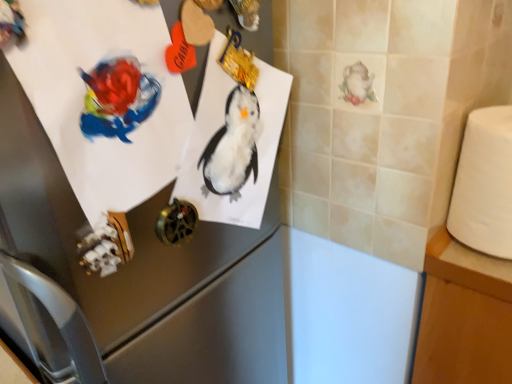
Question: Could white matte toilet paper at right be considered to be inside white wood table at right?

Choices:
 (A) yes
 (B) no

Answer: (B)

Question: Is white wood table at right positioned with its back to white matte toilet paper at right?

Choices:
 (A) yes
 (B) no

Answer: (B)

Question: Is white wood table at right aimed at white matte toilet paper at right?

Choices:
 (A) no
 (B) yes

Answer: (A)

Question: From a real-world perspective, does white wood table at right sit lower than white matte toilet paper at right?

Choices:
 (A) no
 (B) yes

Answer: (B)

Question: From the image's perspective, is white wood table at right below white matte toilet paper at right?

Choices:
 (A) no
 (B) yes

Answer: (B)

Question: Considering the relative positions of white wood table at right and white matte toilet paper at right in the image provided, is white wood table at right in front of white matte toilet paper at right?

Choices:
 (A) yes
 (B) no

Answer: (B)

Question: Does matte paper penguin at upper left appear on the left side of white matte toilet paper at right?

Choices:
 (A) no
 (B) yes

Answer: (B)

Question: Can you confirm if matte paper penguin at upper left is shorter than white matte toilet paper at right?

Choices:
 (A) no
 (B) yes

Answer: (A)

Question: Can you see matte paper penguin at upper left touching white matte toilet paper at right?

Choices:
 (A) yes
 (B) no

Answer: (B)

Question: Is matte paper penguin at upper left outside white matte toilet paper at right?

Choices:
 (A) no
 (B) yes

Answer: (B)

Question: From the image's perspective, is matte paper penguin at upper left beneath white matte toilet paper at right?

Choices:
 (A) no
 (B) yes

Answer: (A)

Question: Is matte paper penguin at upper left positioned behind white matte toilet paper at right?

Choices:
 (A) yes
 (B) no

Answer: (B)

Question: Considering the relative sizes of matte paper penguin at upper left and satin silver refrigerator at upper left in the image provided, is matte paper penguin at upper left bigger than satin silver refrigerator at upper left?

Choices:
 (A) no
 (B) yes

Answer: (A)